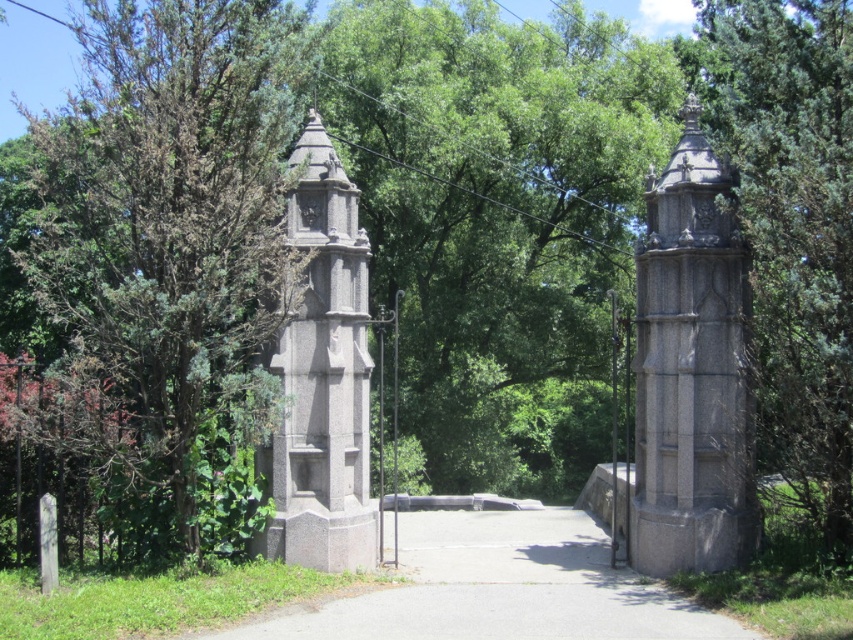
Question: Where is green textured stone pillar at left located in relation to gray concrete path at center in the image?

Choices:
 (A) below
 (B) above

Answer: (B)

Question: Which object is closer to the camera taking this photo?

Choices:
 (A) green textured stone pillar at left
 (B) granite tower at center

Answer: (B)

Question: Is gray concrete path at center to the right of gray stone tower at left from the viewer's perspective?

Choices:
 (A) yes
 (B) no

Answer: (A)

Question: Which point is closer to the camera taking this photo?

Choices:
 (A) pos(830,147)
 (B) pos(727,218)
 (C) pos(498,518)
 (D) pos(181,536)

Answer: (A)

Question: Which object appears closest to the camera in this image?

Choices:
 (A) granite tower at center
 (B) gray concrete path at center
 (C) gray stone tower at left
 (D) green textured stone pillar at center

Answer: (B)

Question: Is granite tower at center thinner than gray stone tower at left?

Choices:
 (A) yes
 (B) no

Answer: (A)